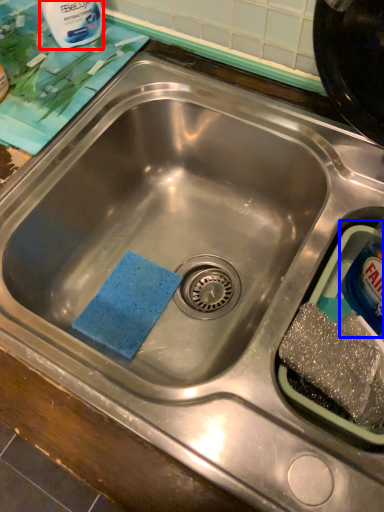
Question: Which of the following is the closest to the observer, cleaning product (highlighted by a red box) or bottle (highlighted by a blue box)?

Choices:
 (A) cleaning product
 (B) bottle

Answer: (B)